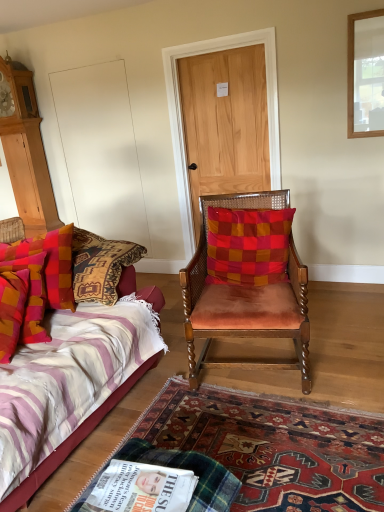
Question: Is velvet orange chair at center further to the viewer compared to red checkered cushion at center, which is the second pillow from left to right?

Choices:
 (A) yes
 (B) no

Answer: (B)

Question: Is velvet orange chair at center oriented away from red checkered cushion at center, which ranks as the first pillow in right-to-left order?

Choices:
 (A) yes
 (B) no

Answer: (A)

Question: Can you confirm if velvet orange chair at center is smaller than red checkered cushion at center, which is the second pillow from left to right?

Choices:
 (A) no
 (B) yes

Answer: (A)

Question: Can you confirm if velvet orange chair at center is bigger than red checkered cushion at center, which is the second pillow from left to right?

Choices:
 (A) no
 (B) yes

Answer: (B)

Question: Can you confirm if velvet orange chair at center is shorter than red checkered cushion at center, which is the second pillow from left to right?

Choices:
 (A) no
 (B) yes

Answer: (A)

Question: Would you consider velvet orange chair at center to be distant from red checkered cushion at center, which ranks as the first pillow in right-to-left order?

Choices:
 (A) yes
 (B) no

Answer: (B)

Question: Could you tell me if light brown wood door at center is facing white glossy magazine at lower center?

Choices:
 (A) no
 (B) yes

Answer: (B)

Question: Is light brown wood door at center positioned far away from white glossy magazine at lower center?

Choices:
 (A) no
 (B) yes

Answer: (B)

Question: Considering the relative sizes of light brown wood door at center and white glossy magazine at lower center in the image provided, is light brown wood door at center bigger than white glossy magazine at lower center?

Choices:
 (A) no
 (B) yes

Answer: (B)

Question: From the image's perspective, is light brown wood door at center above white glossy magazine at lower center?

Choices:
 (A) yes
 (B) no

Answer: (A)

Question: Is light brown wood door at center closer to the viewer compared to white glossy magazine at lower center?

Choices:
 (A) no
 (B) yes

Answer: (A)

Question: Is light brown wood door at center placed right next to white glossy magazine at lower center?

Choices:
 (A) yes
 (B) no

Answer: (B)

Question: Does velvet orange chair at center come behind carpeted rug at lower center?

Choices:
 (A) yes
 (B) no

Answer: (A)